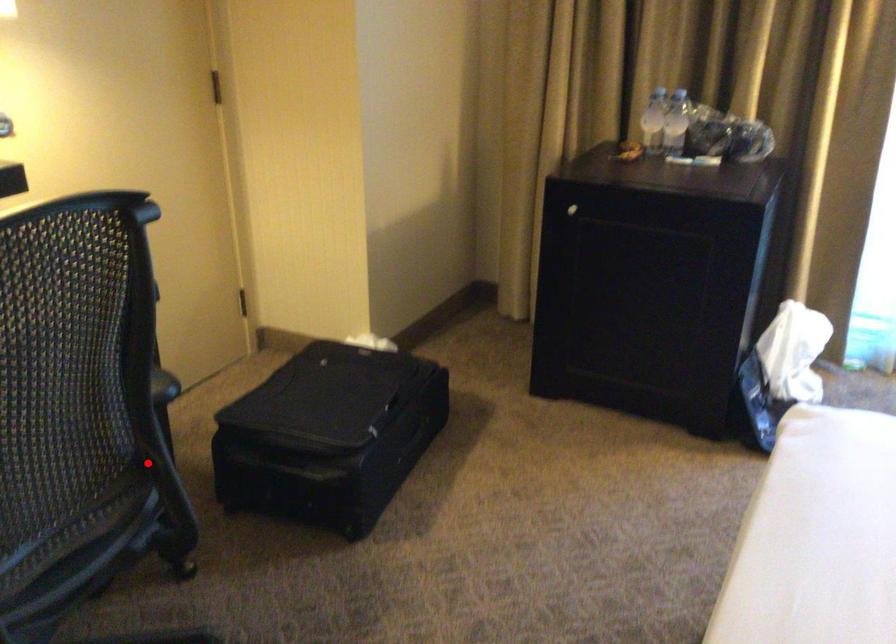
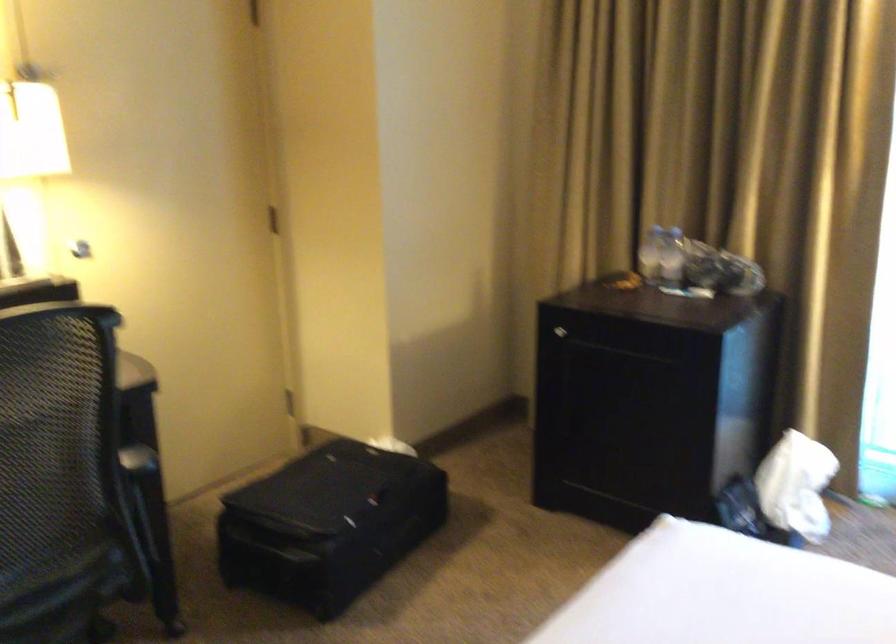
Question: A red point is marked in image1. In image2, is the corresponding 3D point closer to the camera or farther? Reply with the corresponding letter.

Choices:
 (A) The corresponding 3D point is closer.
 (B) The corresponding 3D point is farther.

Answer: (B)